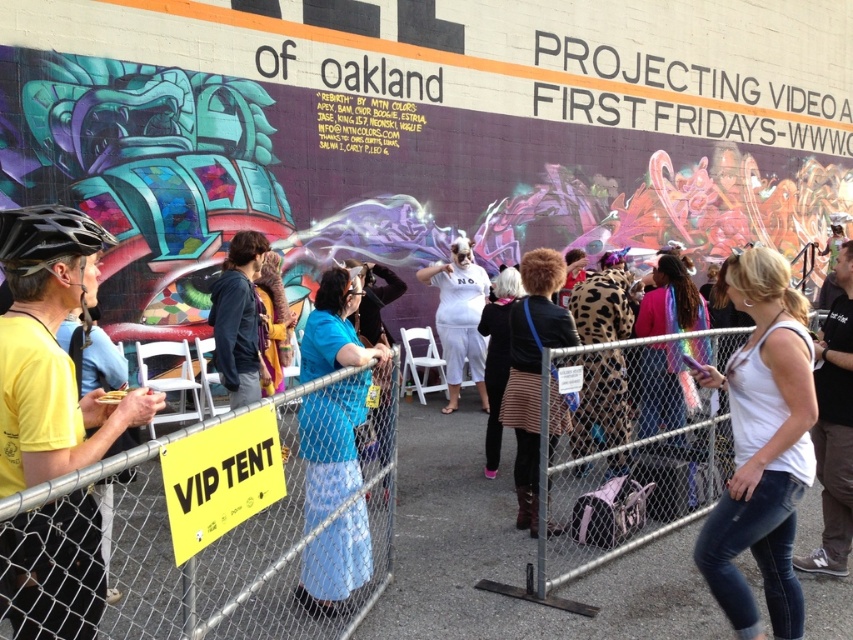
Consider the image. Is metal mesh fence at left above white tank top at center?

Actually, metal mesh fence at left is below white tank top at center.

Looking at this image, which is more to the left, metal mesh fence at left or white tank top at center?

Positioned to the left is metal mesh fence at left.

Locate an element on the screen. The image size is (853, 640). metal mesh fence at left is located at coordinates (213, 525).

Who is positioned more to the left, yellow matte helmet at left or striped sweater at center?

yellow matte helmet at left is more to the left.

Does yellow matte helmet at left appear over striped sweater at center?

Indeed, yellow matte helmet at left is positioned over striped sweater at center.

What do you see at coordinates (51, 349) in the screenshot? I see `yellow matte helmet at left` at bounding box center [51, 349].

This screenshot has width=853, height=640. Identify the location of yellow matte helmet at left. (51, 349).

Does metal mesh fence at center appear on the right side of striped sweater at center?

Yes, metal mesh fence at center is to the right of striped sweater at center.

Is point (569, 474) farther from viewer compared to point (498, 298)?

No, it is not.

Which is in front, point (540, 545) or point (502, 376)?

Point (540, 545) is in front.

Where is `metal mesh fence at center`? The image size is (853, 640). metal mesh fence at center is located at coordinates (624, 500).